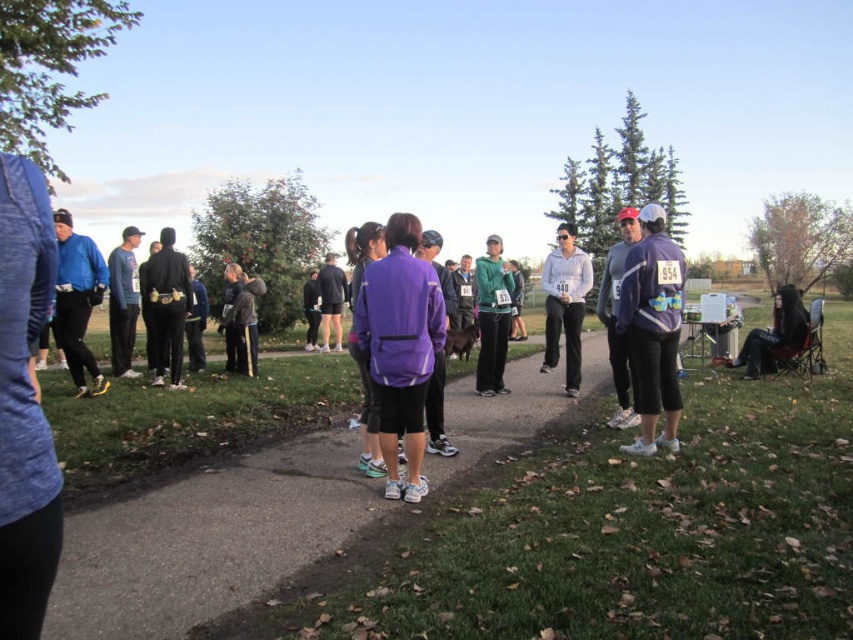
Question: Which point is closer to the camera?

Choices:
 (A) (662, 225)
 (B) (492, 346)
 (C) (306, 339)

Answer: (A)

Question: Considering the relative positions of matte black jacket at lower right and matte black shorts at center in the image provided, where is matte black jacket at lower right located with respect to matte black shorts at center?

Choices:
 (A) left
 (B) right

Answer: (B)

Question: Which point is closer to the camera?

Choices:
 (A) (242, 328)
 (B) (223, 314)
 (C) (785, 317)

Answer: (C)

Question: Which object is positioned closest to the matte black jacket at lower right?

Choices:
 (A) black leather jacket at center
 (B) purple matte jacket at center
 (C) matte purple jacket at right
 (D) matte green jacket at center

Answer: (D)

Question: Does purple fabric jacket at center have a larger size compared to dark brown leather jacket at center?

Choices:
 (A) yes
 (B) no

Answer: (B)

Question: Is black matte pants at center thinner than matte black jacket at lower right?

Choices:
 (A) yes
 (B) no

Answer: (A)